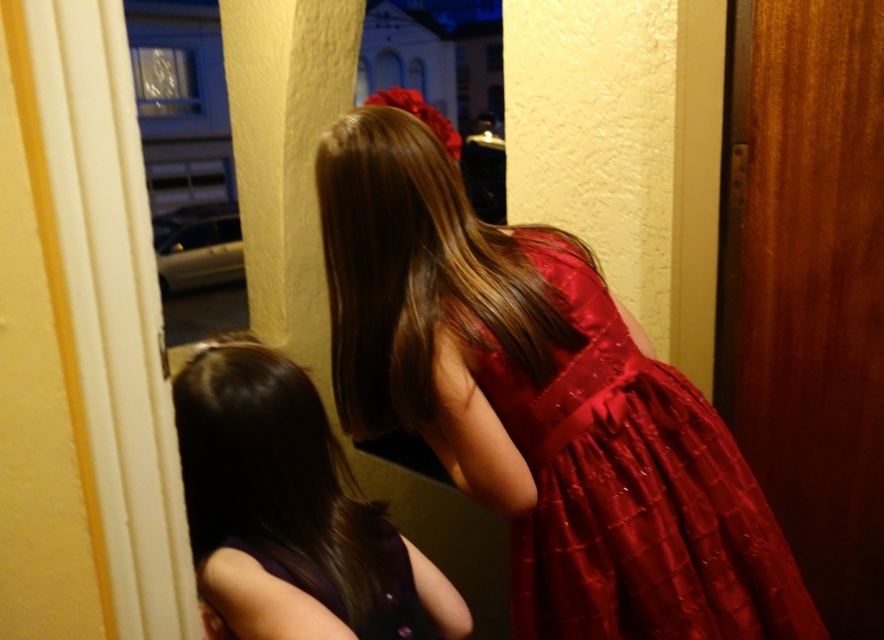
Question: Which object is farther from the camera taking this photo?

Choices:
 (A) purple satin dress at lower left
 (B) shiny brown hair at center
 (C) shiny purple dress at lower left
 (D) shiny red dress at center

Answer: (D)

Question: Does shiny red dress at center have a larger size compared to purple satin dress at lower left?

Choices:
 (A) no
 (B) yes

Answer: (B)

Question: Is the position of shiny red dress at center more distant than that of purple satin dress at lower left?

Choices:
 (A) no
 (B) yes

Answer: (B)

Question: Which object is closer to the camera taking this photo?

Choices:
 (A) shiny red dress at center
 (B) shiny purple dress at lower left
 (C) shiny brown hair at center
 (D) purple satin dress at lower left

Answer: (D)

Question: Is shiny red dress at center below purple satin dress at lower left?

Choices:
 (A) yes
 (B) no

Answer: (B)

Question: Considering the real-world distances, which object is farthest from the purple satin dress at lower left?

Choices:
 (A) shiny purple dress at lower left
 (B) shiny brown hair at center
 (C) shiny red dress at center

Answer: (B)